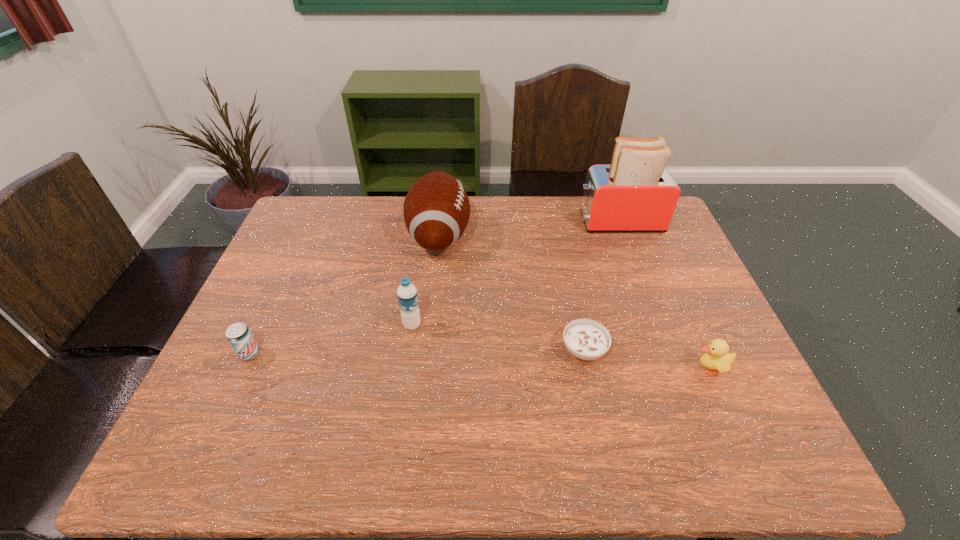
Locate an element on the screen. The width and height of the screenshot is (960, 540). free spot that satisfies the following two spatial constraints: 1. on the laces of the football; 2. on the front side of the leftmost object is located at coordinates (427, 353).

What are the coordinates of `vacant position in the image that satisfies the following two spatial constraints: 1. on the label of the third object from right to left; 2. on the right side of the fourth shortest object` in the screenshot? It's located at (409, 350).

Locate an element on the screen. free space that satisfies the following two spatial constraints: 1. on the label of the water bottle; 2. on the right side of the shortest object is located at coordinates (409, 350).